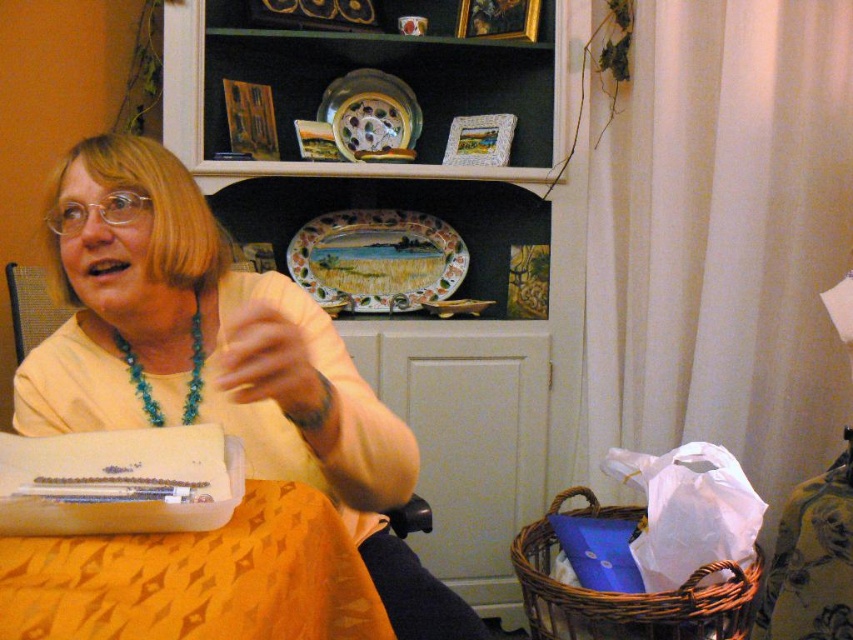
You are standing in front of the table where the person is working. There are two points marked in the image. The first point is at coordinates point (399, 298) and the second is at point (236, 356). If you were to walk straight towards the shelving unit in the background, which point would you encounter first?

Point (236, 356) would be encountered first because it is in front of point (399, 298) according to the spatial relationship provided.

You are organizing a small event and need to place a centerpiece on the yellow fabric table at lower left. The decorative ceramic platter at center is available. Will the platter fit on the table?

The yellow fabric table at lower left is larger in size than the decorative ceramic platter at center, so the platter will fit on the table.

You are standing in front of the shelving unit and want to reach the matte ceramic plate at upper center. If your maximum reach is 5 feet, can you touch it without moving closer?

The matte ceramic plate at upper center is 6.10 feet away from the camera, which is beyond your maximum reach of 5 feet. You would need to move closer to touch it.